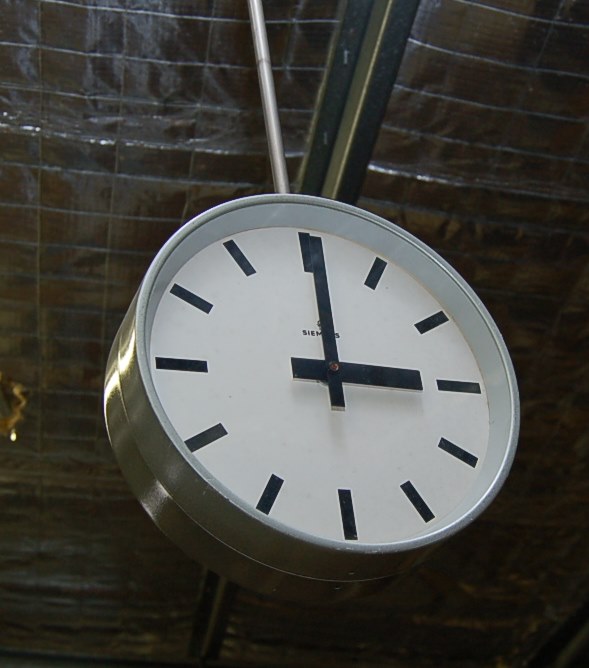
Where is `face of clock`? This screenshot has height=668, width=589. face of clock is located at coordinates (320, 442).